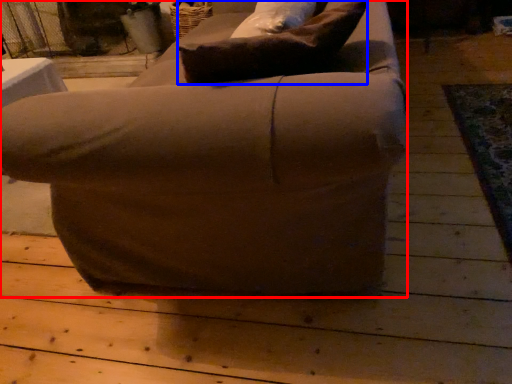
Question: Which point is further to the camera, chair (highlighted by a red box) or pillow (highlighted by a blue box)?

Choices:
 (A) chair
 (B) pillow

Answer: (B)